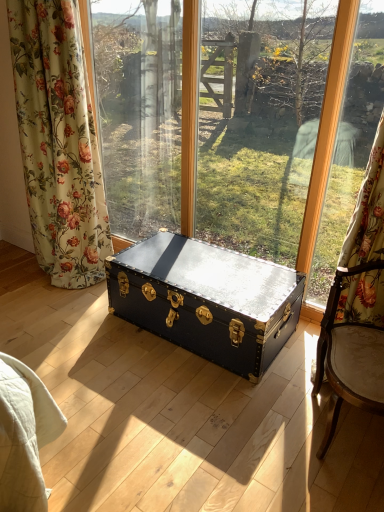
Question: In terms of width, does shiny black trunk at center look wider or thinner when compared to matte black trunk at center?

Choices:
 (A) thin
 (B) wide

Answer: (B)

Question: Which is correct: shiny black trunk at center is inside matte black trunk at center, or outside of it?

Choices:
 (A) outside
 (B) inside

Answer: (A)

Question: Which is nearer to the floral fabric curtain at left?

Choices:
 (A) matte black trunk at center
 (B) shiny black trunk at center
 (C) wooden frame at right

Answer: (B)

Question: Estimate the real-world distances between objects in this image. Which object is farther from the wooden frame at right?

Choices:
 (A) shiny black trunk at center
 (B) floral fabric curtain at left
 (C) matte black trunk at center

Answer: (B)